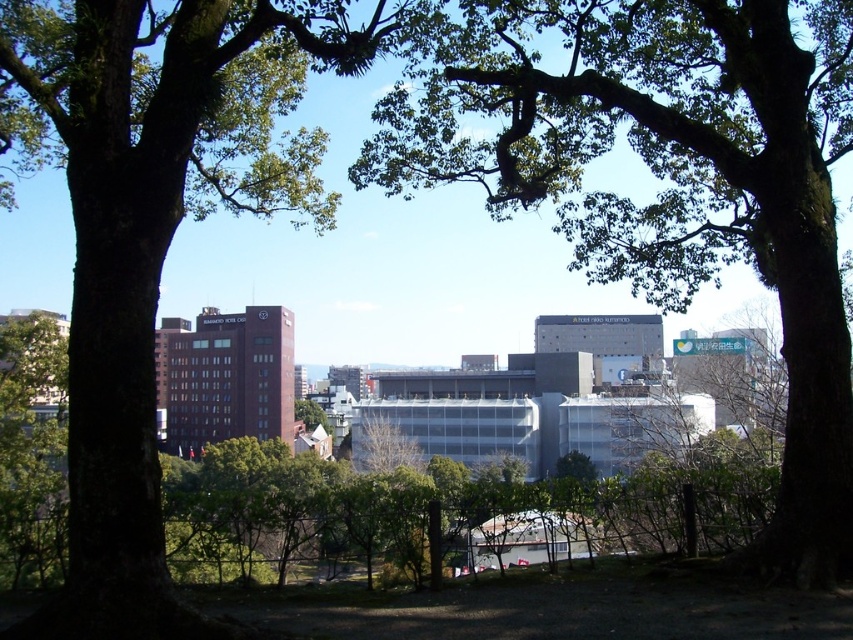
Question: Which point is closer to the camera?

Choices:
 (A) (688, 83)
 (B) (256, 36)

Answer: (B)

Question: Does green leafy tree at center appear over green leafy tree at left?

Choices:
 (A) no
 (B) yes

Answer: (A)

Question: Which point is farther to the camera?

Choices:
 (A) (795, 477)
 (B) (115, 458)

Answer: (A)

Question: Is green leafy tree at center bigger than green leafy tree at left?

Choices:
 (A) yes
 (B) no

Answer: (A)

Question: Considering the relative positions of green leafy tree at center and green leafy tree at left in the image provided, where is green leafy tree at center located with respect to green leafy tree at left?

Choices:
 (A) above
 (B) below

Answer: (B)